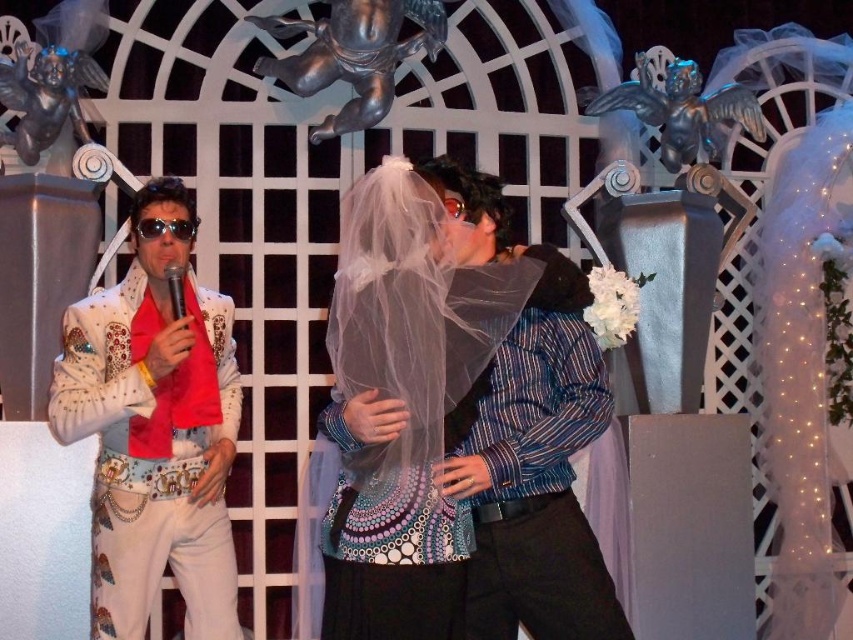
Question: Can you confirm if matte white veil at center is positioned to the left of white sequined jacket at left?

Choices:
 (A) no
 (B) yes

Answer: (A)

Question: Which object appears farthest from the camera in this image?

Choices:
 (A) white sequined jacket at left
 (B) matte white veil at center

Answer: (A)

Question: In this image, where is matte white veil at center located relative to white sequined jacket at left?

Choices:
 (A) below
 (B) above

Answer: (B)

Question: Can you confirm if matte white veil at center is positioned to the left of white sequined jacket at left?

Choices:
 (A) yes
 (B) no

Answer: (B)

Question: Which point is farther to the camera?

Choices:
 (A) white sequined jacket at left
 (B) matte white veil at center

Answer: (A)